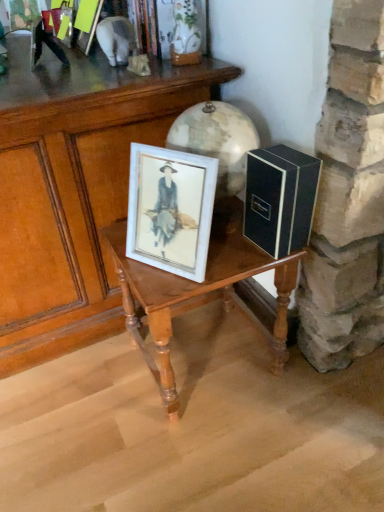
I want to click on unoccupied region to the right of white matte picture frame at center, so click(228, 261).